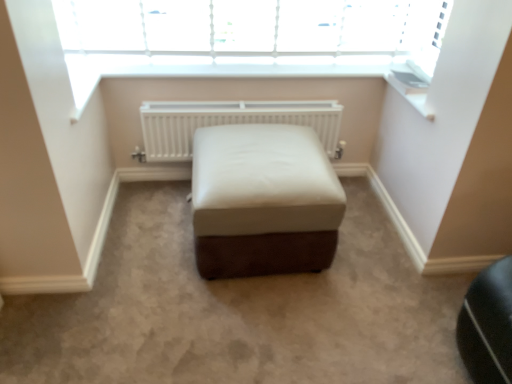
The image size is (512, 384). Identify the location of free spot in front of white leather ottoman at center. (254, 328).